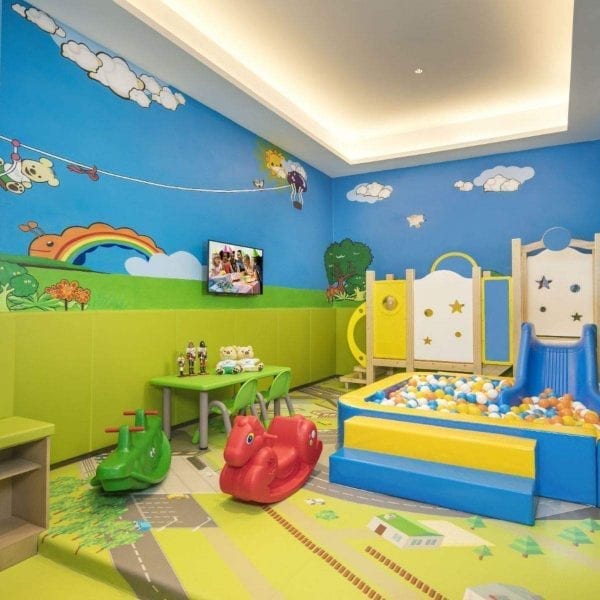
The image size is (600, 600). I want to click on cloud mural, so click(504, 182).